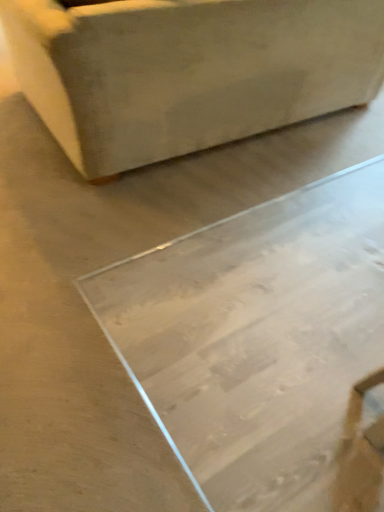
Where is `space that is in front of matte beige ottoman at upper left`? The height and width of the screenshot is (512, 384). space that is in front of matte beige ottoman at upper left is located at coordinates coord(201,263).